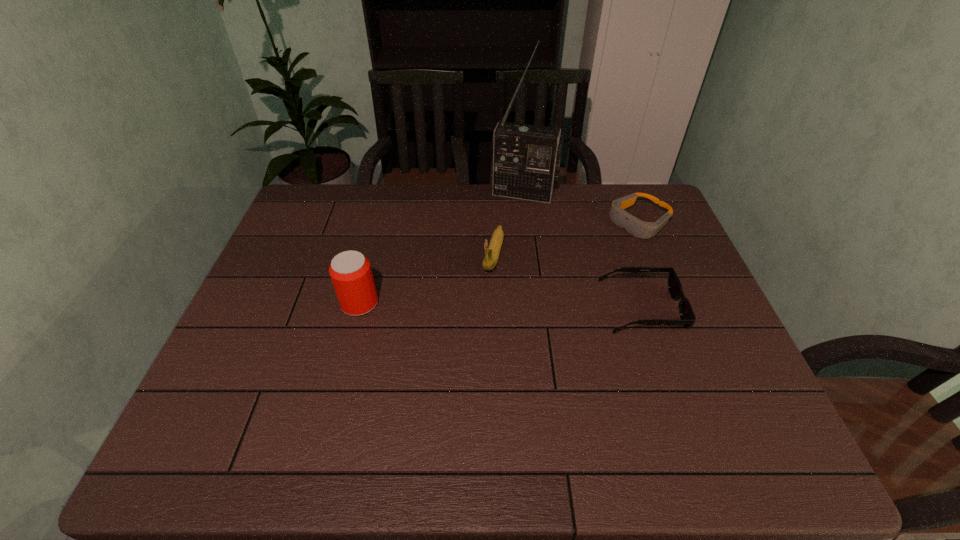
Find the location of a particular element. The height and width of the screenshot is (540, 960). sunglasses that is at the right edge is located at coordinates (687, 316).

The width and height of the screenshot is (960, 540). What are the coordinates of `goggles at the right edge` in the screenshot? It's located at (641, 229).

I want to click on object that is positioned at the far right corner, so click(641, 229).

The width and height of the screenshot is (960, 540). In the image, there is a desktop. Identify the location of vacant space at the far edge. (571, 226).

Locate an element on the screen. This screenshot has height=540, width=960. free space at the near edge of the desktop is located at coordinates (423, 417).

In the image, there is a desktop. What are the coordinates of `free space at the left edge` in the screenshot? It's located at (257, 296).

This screenshot has height=540, width=960. I want to click on free space at the right edge, so click(719, 341).

The image size is (960, 540). In order to click on vacant space at the far left corner of the desktop in this screenshot , I will do `click(301, 196)`.

Where is `unoccupied position between the sunglasses and the goggles`? This screenshot has width=960, height=540. unoccupied position between the sunglasses and the goggles is located at coordinates (640, 265).

Find the location of a particular element. The image size is (960, 540). vacant space that is in between the third shortest object and the tallest object is located at coordinates (509, 224).